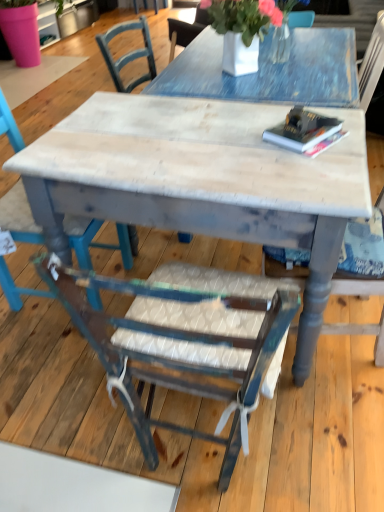
Question: Is wooden chair with woven seat at center, which is the 2th chair in right-to-left order, oriented away from hardcover book at upper right?

Choices:
 (A) yes
 (B) no

Answer: (B)

Question: Considering the relative sizes of wooden chair with woven seat at center, which is the 2th chair in right-to-left order, and hardcover book at upper right in the image provided, is wooden chair with woven seat at center, which is the 2th chair in right-to-left order, shorter than hardcover book at upper right?

Choices:
 (A) yes
 (B) no

Answer: (B)

Question: Can you confirm if wooden chair with woven seat at center, which is the 2th chair in right-to-left order, is smaller than hardcover book at upper right?

Choices:
 (A) no
 (B) yes

Answer: (A)

Question: Is wooden chair with woven seat at center, which is the 2th chair in left-to-right order, at the right side of hardcover book at upper right?

Choices:
 (A) no
 (B) yes

Answer: (A)

Question: Is wooden chair with woven seat at center, which is the 2th chair in left-to-right order, positioned behind hardcover book at upper right?

Choices:
 (A) yes
 (B) no

Answer: (B)

Question: Does wooden chair with woven seat at center, which is the 2th chair in left-to-right order, have a greater width compared to hardcover book at upper right?

Choices:
 (A) yes
 (B) no

Answer: (A)

Question: Is wooden chair with woven seat at center, which is the 2th chair in right-to-left order, not close to distressed wood table at center?

Choices:
 (A) yes
 (B) no

Answer: (B)

Question: From a real-world perspective, is wooden chair with woven seat at center, which is the 2th chair in right-to-left order, located higher than distressed wood table at center?

Choices:
 (A) no
 (B) yes

Answer: (B)

Question: Is wooden chair with woven seat at center, which is the 2th chair in left-to-right order, further to the viewer compared to distressed wood table at center?

Choices:
 (A) no
 (B) yes

Answer: (A)

Question: Is wooden chair with woven seat at center, which is the 2th chair in left-to-right order, taller than distressed wood table at center?

Choices:
 (A) no
 (B) yes

Answer: (B)

Question: From the image's perspective, is wooden chair with woven seat at center, which is the 2th chair in right-to-left order, on distressed wood table at center?

Choices:
 (A) no
 (B) yes

Answer: (A)

Question: Is wooden chair with woven seat at center, which is the 2th chair in left-to-right order, thinner than distressed wood table at center?

Choices:
 (A) yes
 (B) no

Answer: (A)

Question: Does distressed wood table at center lie behind distressed wood chair at lower left, which is counted as the third chair, starting from the right?

Choices:
 (A) no
 (B) yes

Answer: (A)